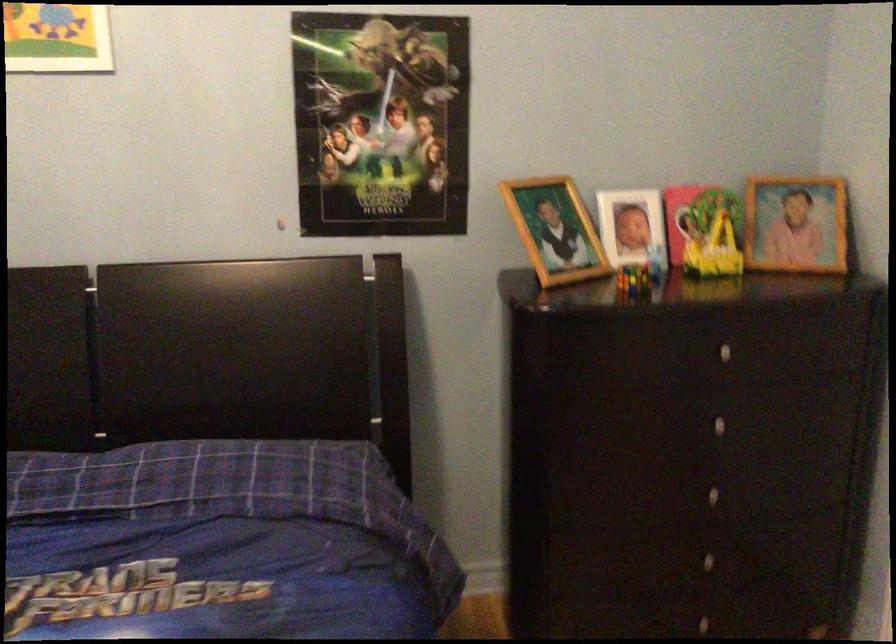
What do you see at coordinates (719, 240) in the screenshot? I see `the yellow mug handle` at bounding box center [719, 240].